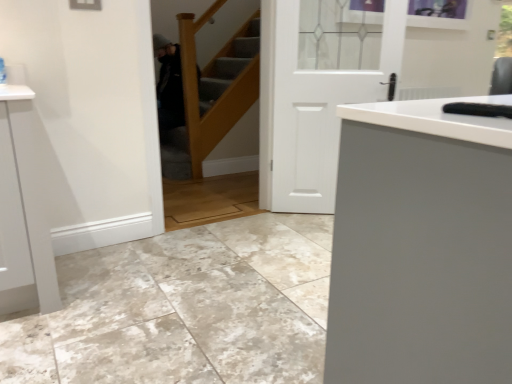
Where is `vacant space situated on the left part of white wooden door at center`? The image size is (512, 384). vacant space situated on the left part of white wooden door at center is located at coordinates (264, 226).